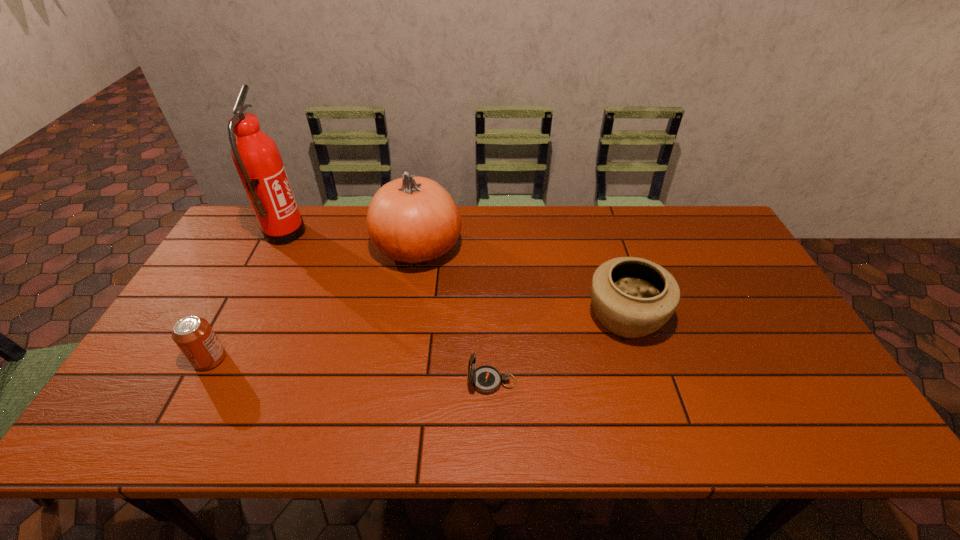
This screenshot has width=960, height=540. In order to click on the tallest object in this screenshot , I will do `click(257, 159)`.

The image size is (960, 540). Identify the location of the third object from left to right. (413, 220).

Find the location of a particular element. pumpkin is located at coordinates (413, 220).

What are the coordinates of `pottery` in the screenshot? It's located at (632, 297).

Find the location of a particular element. the rightmost object is located at coordinates (632, 297).

Find the location of a particular element. can is located at coordinates (194, 336).

What are the coordinates of `the second object from right to left` in the screenshot? It's located at coord(485,379).

Where is `compass`? The height and width of the screenshot is (540, 960). compass is located at coordinates (485, 379).

Identify the location of vacant space located on the label side of the fire extinguisher. Image resolution: width=960 pixels, height=540 pixels. (347, 234).

Image resolution: width=960 pixels, height=540 pixels. I want to click on free location located 0.280m on the front of the fourth shortest object, so click(401, 355).